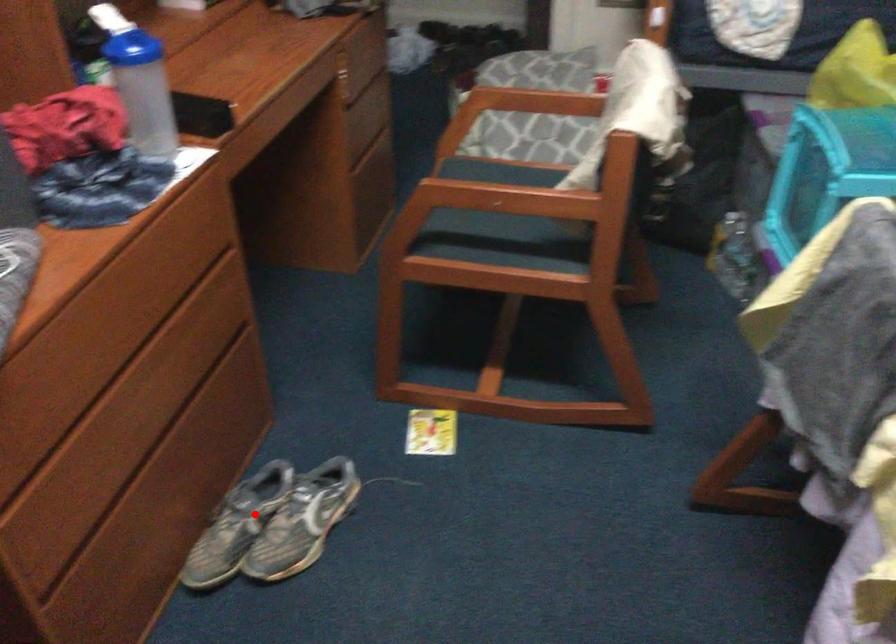
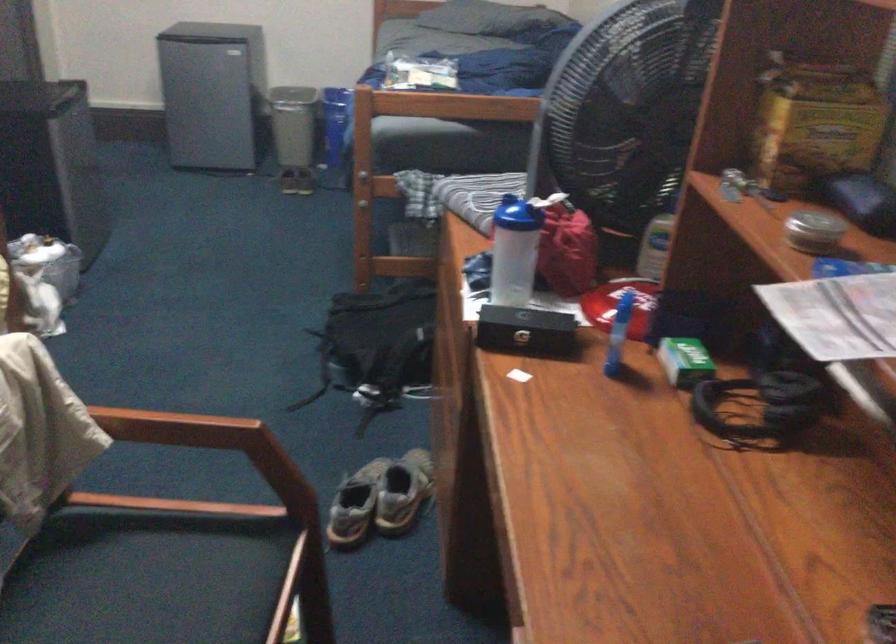
In the second image, find the point that corresponds to the highlighted location in the first image.

(402, 491)